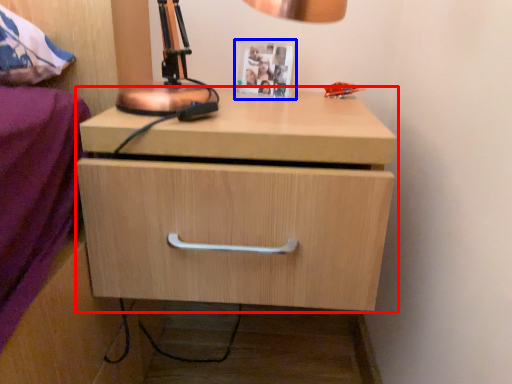
Question: Which object is closer to the camera taking this photo, chest of drawers (highlighted by a red box) or picture frame (highlighted by a blue box)?

Choices:
 (A) chest of drawers
 (B) picture frame

Answer: (A)